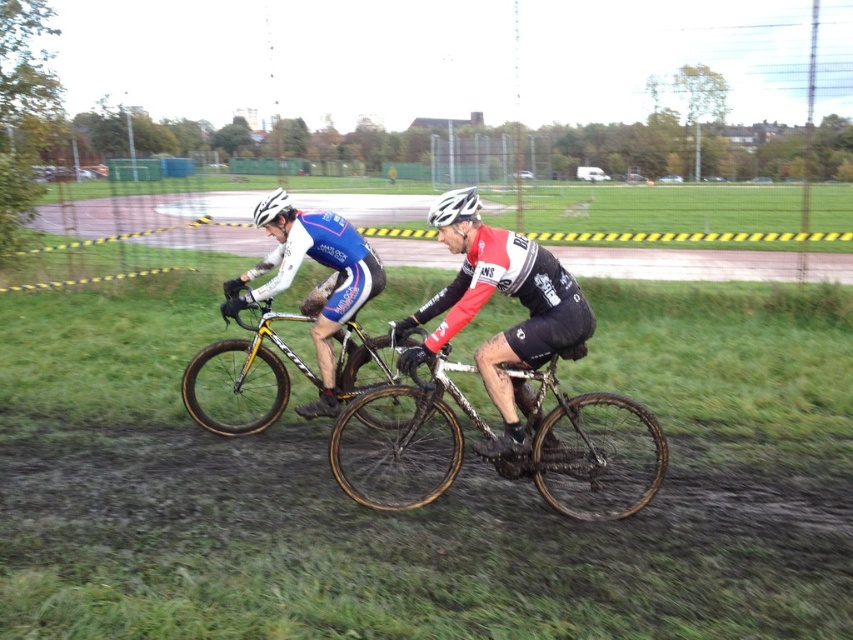
Between matte blue cycling jersey at center and yellow matte bicycle at center, which one has less height?

Standing shorter between the two is yellow matte bicycle at center.

Is point (378, 268) positioned before point (262, 355)?

That is False.

The width and height of the screenshot is (853, 640). In order to click on matte blue cycling jersey at center in this screenshot , I will do `click(315, 285)`.

Can you confirm if muddy metallic bicycle at center is wider than shiny black cycling jersey at center?

Indeed, muddy metallic bicycle at center has a greater width compared to shiny black cycling jersey at center.

What are the coordinates of `muddy metallic bicycle at center` in the screenshot? It's located at (590, 452).

Between muddy metallic bicycle at center and white matte bicycle helmet at center, which one appears on the left side from the viewer's perspective?

From the viewer's perspective, white matte bicycle helmet at center appears more on the left side.

Between point (646, 433) and point (444, 208), which one is positioned behind?

The point (646, 433) is more distant.

Who is more distant from viewer, (515, 468) or (436, 205)?

The point (515, 468) is more distant.

Image resolution: width=853 pixels, height=640 pixels. Find the location of `muddy metallic bicycle at center`. muddy metallic bicycle at center is located at coordinates (590, 452).